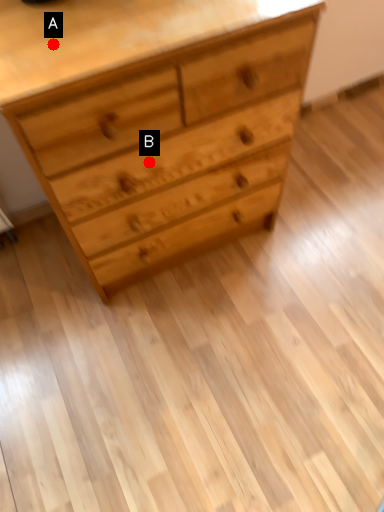
Question: Two points are circled on the image, labeled by A and B beside each circle. Which point is closer to the camera?

Choices:
 (A) A is closer
 (B) B is closer

Answer: (A)